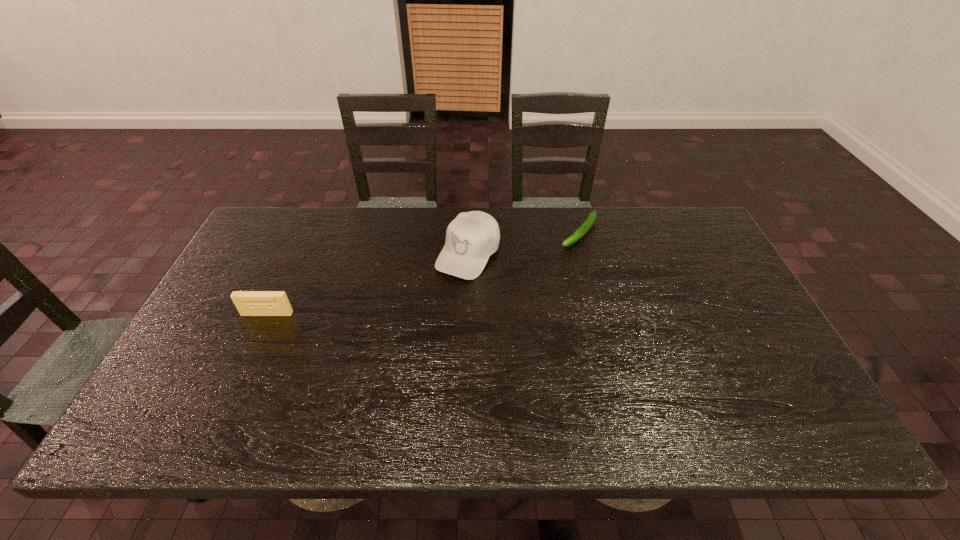
The width and height of the screenshot is (960, 540). In order to click on vacant region at the near edge of the desktop in this screenshot , I will do pyautogui.click(x=354, y=380).

I want to click on vacant space at the right edge of the desktop, so click(708, 268).

Locate an element on the screen. blank space at the far left corner of the desktop is located at coordinates coord(270,228).

Where is `vacant region at the near left corner of the desktop`? vacant region at the near left corner of the desktop is located at coordinates (201, 384).

Find the location of `free location at the far right corner`. free location at the far right corner is located at coordinates (662, 222).

The image size is (960, 540). Identify the location of free space between the shortest object and the leftmost object. (456, 322).

The height and width of the screenshot is (540, 960). I want to click on unoccupied position between the third shortest object and the baseball cap, so click(x=368, y=284).

This screenshot has width=960, height=540. Identify the location of free space between the zucchini and the third shortest object. (423, 273).

Locate an element on the screen. This screenshot has height=540, width=960. empty space between the shortest object and the zucchini is located at coordinates (612, 281).

Find the location of a particular element. vacant area that lies between the zucchini and the shortest object is located at coordinates (612, 281).